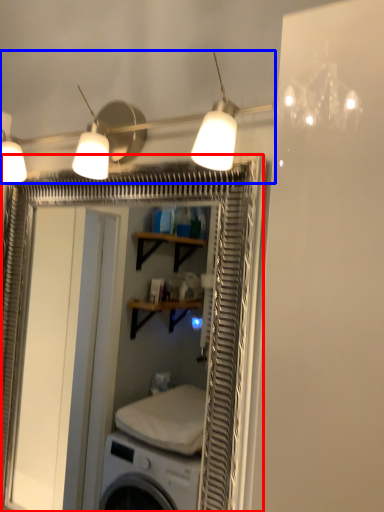
Question: Among these objects, which one is nearest to the camera, screen door (highlighted by a red box) or lamp (highlighted by a blue box)?

Choices:
 (A) screen door
 (B) lamp

Answer: (B)